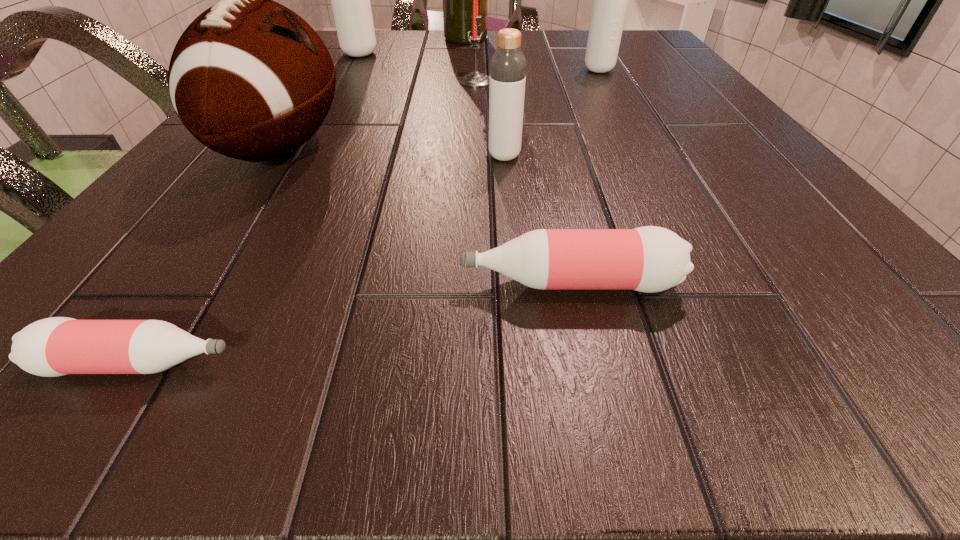
The image size is (960, 540). Find the location of `object present at the near left corner`. object present at the near left corner is located at coordinates (56, 346).

Image resolution: width=960 pixels, height=540 pixels. In order to click on vacant space at the far edge of the desktop in this screenshot , I will do `click(381, 56)`.

Where is `vacant space at the near edge`? vacant space at the near edge is located at coordinates (288, 338).

In the image, there is a desktop. What are the coordinates of `blank space at the right edge` in the screenshot? It's located at (645, 83).

Where is `free space at the near left corner`? free space at the near left corner is located at coordinates (90, 375).

At what (x,y) coordinates should I click in order to perform the action: click on vacant region at the far right corner of the desktop. Please return your answer as a coordinate pair (x, y). Looking at the image, I should click on (638, 47).

Identify the location of vacant space in between the wine bottle and the bigger pink bottle. The width and height of the screenshot is (960, 540). (517, 161).

The image size is (960, 540). Identify the location of unoccupied area between the smallest gray bottle and the right pink bottle. (537, 220).

This screenshot has width=960, height=540. I want to click on unoccupied area between the second shortest bottle and the shortest object, so click(354, 323).

Where is `free space between the farthest gray bottle and the smaller pink bottle`? The width and height of the screenshot is (960, 540). free space between the farthest gray bottle and the smaller pink bottle is located at coordinates (250, 209).